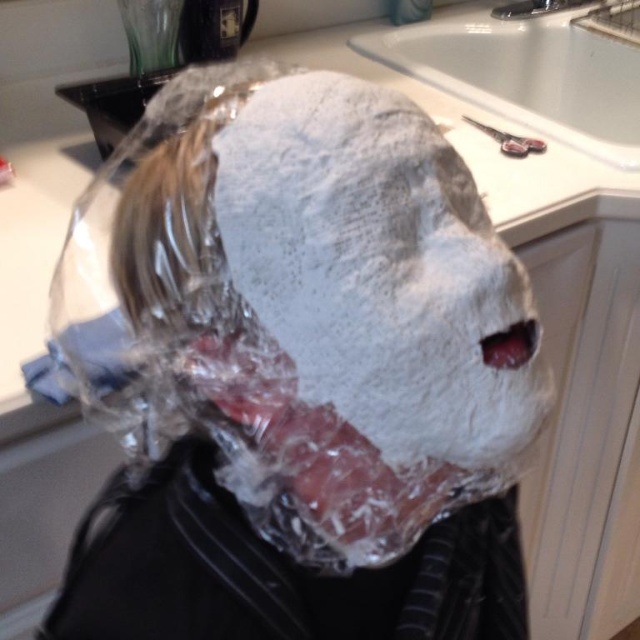
Question: Considering the relative positions of white powder mask at center and white ceramic sink at upper center in the image provided, where is white powder mask at center located with respect to white ceramic sink at upper center?

Choices:
 (A) above
 (B) below

Answer: (B)

Question: Does white powder mask at center appear on the left side of white ceramic sink at upper center?

Choices:
 (A) yes
 (B) no

Answer: (A)

Question: Which point appears closest to the camera in this image?

Choices:
 (A) (451, 259)
 (B) (518, 64)

Answer: (A)

Question: Does white powder mask at center appear on the right side of white ceramic sink at upper center?

Choices:
 (A) yes
 (B) no

Answer: (B)

Question: Which point is closer to the camera taking this photo?

Choices:
 (A) (554, 125)
 (B) (326, 266)

Answer: (B)